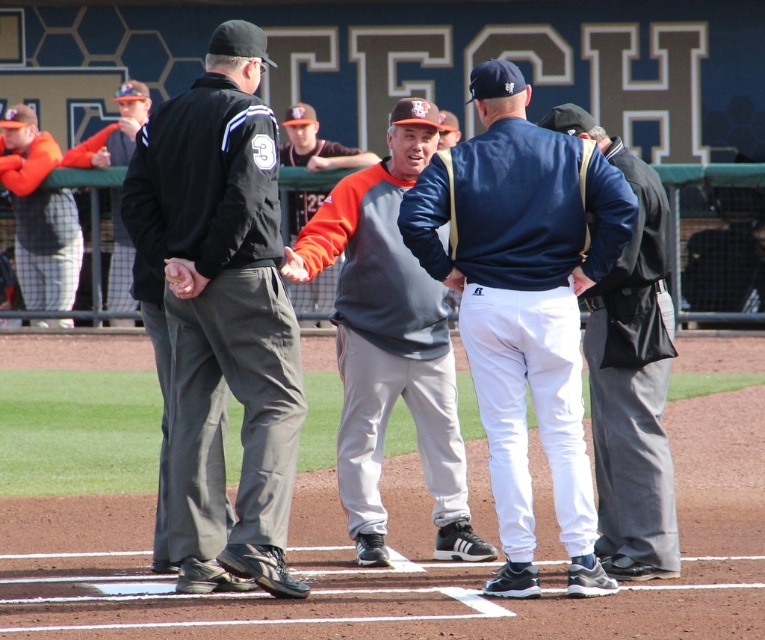
You are standing at the point labeled point (54, 308) and want to walk to the home plate. There is a person at point (441, 356) blocking your path. Can you walk around them without crossing their position?

Point (441, 356) is in front of point (54, 308), so you can walk around the person at point (441, 356) either to the left or right side to reach home plate without crossing their position.

You are a photographer at the baseball game and want to capture both the orange mesh pants at left and the orange fabric jacket at center in a single shot. Since you want to emphasize the height difference between them, which object should you focus on to ensure the taller one is clearly visible?

The orange mesh pants at left is taller than the orange fabric jacket at center, so focusing on the orange mesh pants at left will ensure the taller object is clearly visible in the photo.

You are standing at the point labeled point (153, 150) and want to walk to the point labeled point (112, 284). Which direction should you face to move towards your destination?

You should face southwest because point (153, 150) is in front of point (112, 284), meaning it is closer to the viewer. To reach point (112, 284), you need to move away from the viewer, which would be southwest direction.